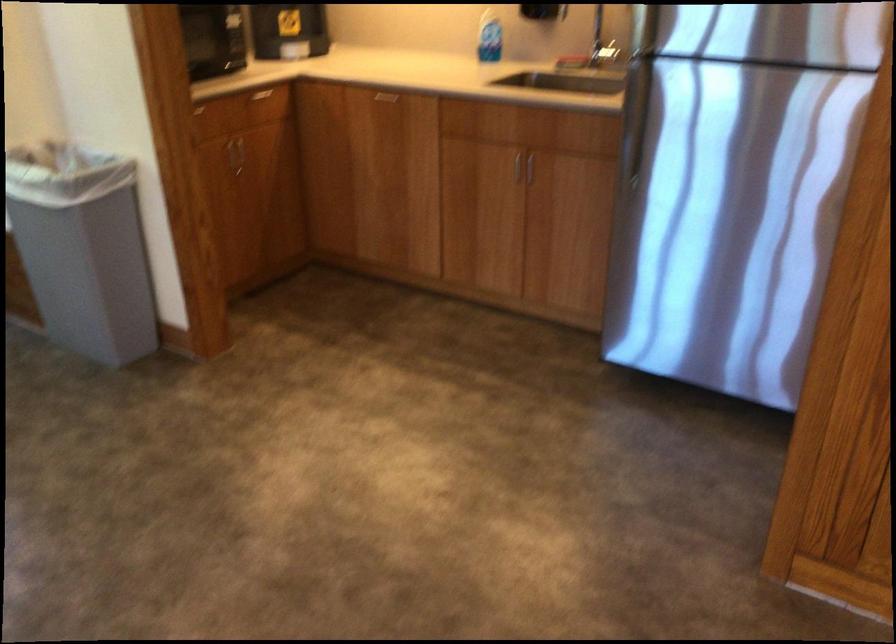
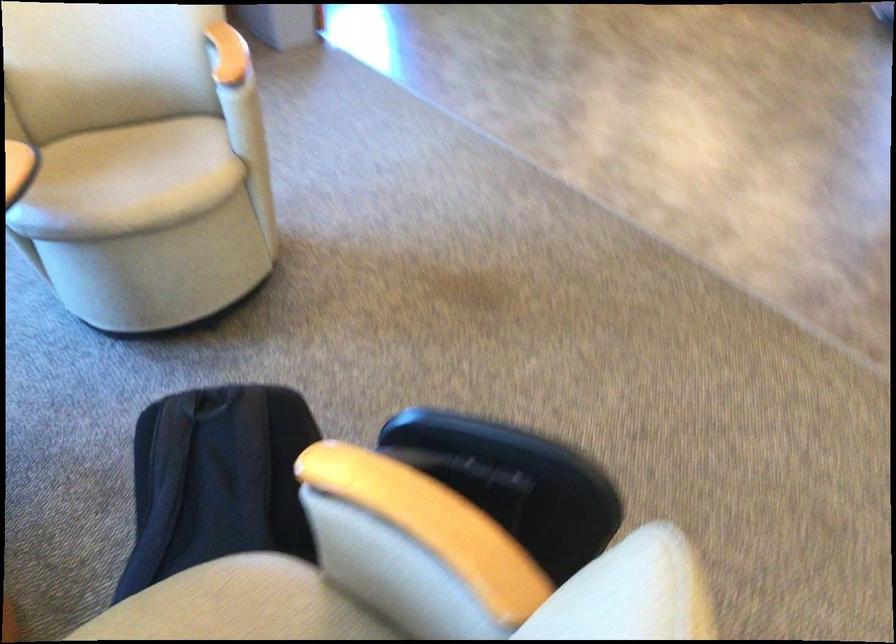
Question: The images are taken continuously from a first-person perspective. In which direction are you moving?

Choices:
 (A) Left
 (B) Right
 (C) Forward
 (D) Backward

Answer: (D)